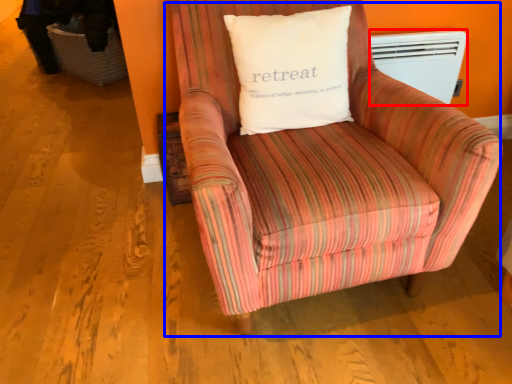
Question: Which of the following is the closest to the observer, heater (highlighted by a red box) or chair (highlighted by a blue box)?

Choices:
 (A) heater
 (B) chair

Answer: (B)